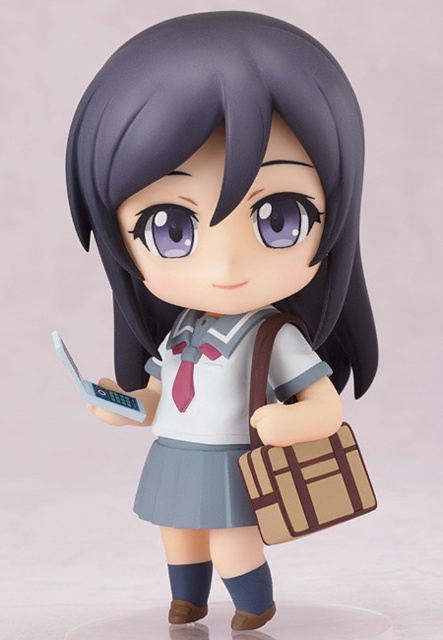
Question: Does matte plastic figure at center appear under beige fabric briefcase at lower right?

Choices:
 (A) yes
 (B) no

Answer: (B)

Question: Does matte plastic figure at center lie behind matte gray fabric school uniform at center?

Choices:
 (A) yes
 (B) no

Answer: (B)

Question: Where is matte gray fabric school uniform at center located in relation to beige fabric briefcase at lower right in the image?

Choices:
 (A) right
 (B) left

Answer: (B)

Question: Among these objects, which one is farthest from the camera?

Choices:
 (A) beige fabric briefcase at lower right
 (B) matte gray fabric school uniform at center
 (C) matte plastic figure at center

Answer: (B)

Question: Which point is farther from the camera taking this photo?

Choices:
 (A) (354, 465)
 (B) (267, 314)

Answer: (B)

Question: Which object is the closest to the matte plastic figure at center?

Choices:
 (A) matte gray fabric school uniform at center
 (B) beige fabric briefcase at lower right

Answer: (A)